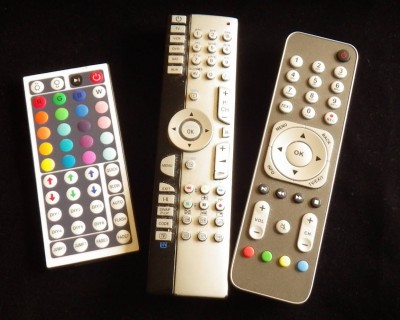
Locate an element on the screen. The image size is (400, 320). grey color remote is located at coordinates (282, 283).